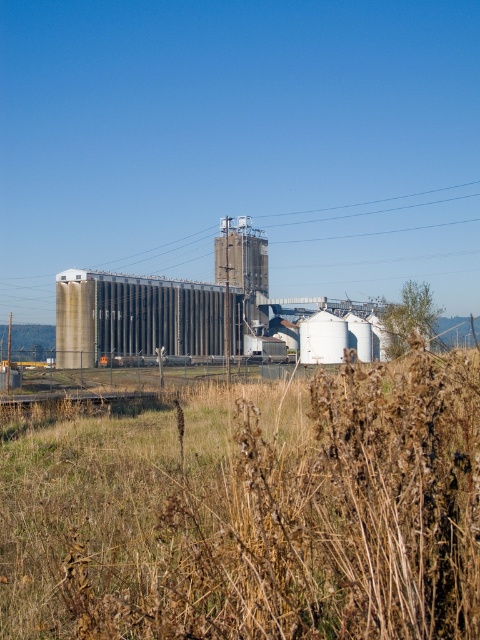
Between point (153, 413) and point (294, 275), which one is positioned in front?

Point (153, 413) is more forward.

Where is `brown dry grass at center`? The height and width of the screenshot is (640, 480). brown dry grass at center is located at coordinates (252, 513).